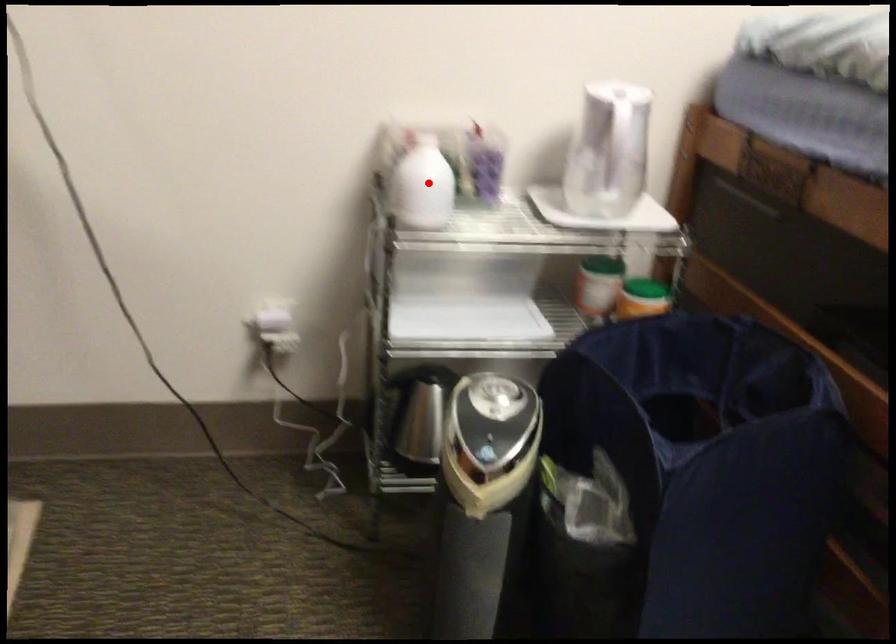
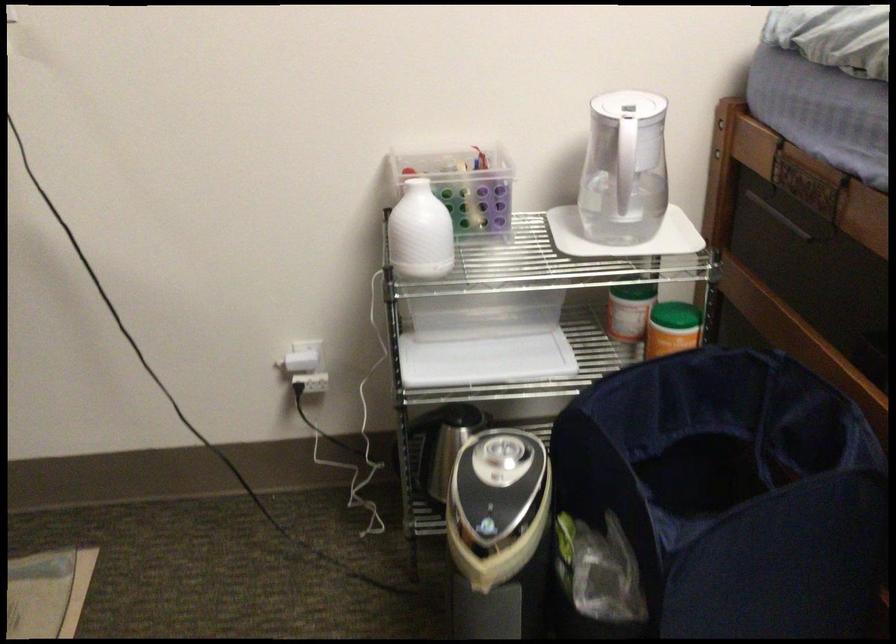
Where in the second image is the point corresponding to the highlighted location from the first image?

(419, 232)